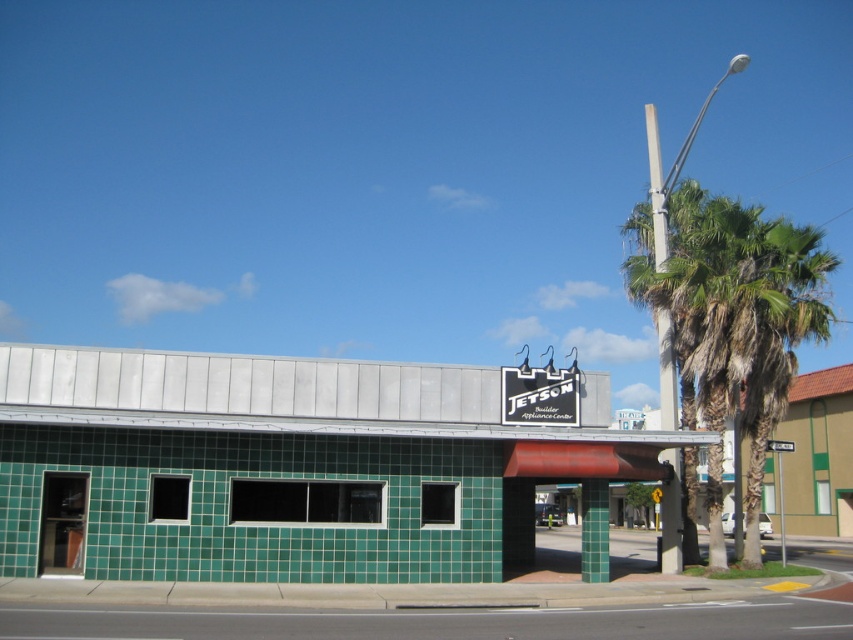
Looking at this image, is black plastic sign at upper center further to camera compared to black plastic sign at center?

No, black plastic sign at upper center is closer to the viewer.

Does point (577, 419) lie in front of point (792, 445)?

Yes, point (577, 419) is closer to viewer.

Where is `black plastic sign at upper center`? This screenshot has height=640, width=853. black plastic sign at upper center is located at coordinates (538, 396).

Does green leafy palm tree at upper right appear on the left side of black plastic sign at center?

In fact, green leafy palm tree at upper right is to the right of black plastic sign at center.

Is green leafy palm tree at upper right thinner than black plastic sign at center?

Incorrect, green leafy palm tree at upper right's width is not less than black plastic sign at center's.

This screenshot has height=640, width=853. Describe the element at coordinates (733, 307) in the screenshot. I see `green leafy palm tree at upper right` at that location.

Where is `green leafy palm tree at upper right`? The width and height of the screenshot is (853, 640). green leafy palm tree at upper right is located at coordinates (733, 307).

Between green leafy palm tree at upper right and black plastic sign at upper center, which one has more height?

With more height is green leafy palm tree at upper right.

Measure the distance from green leafy palm tree at upper right to black plastic sign at upper center.

green leafy palm tree at upper right is 17.93 feet from black plastic sign at upper center.

Between point (763, 362) and point (541, 388), which one is positioned behind?

The point (763, 362) is more distant.

Locate an element on the screen. The height and width of the screenshot is (640, 853). green leafy palm tree at upper right is located at coordinates (733, 307).